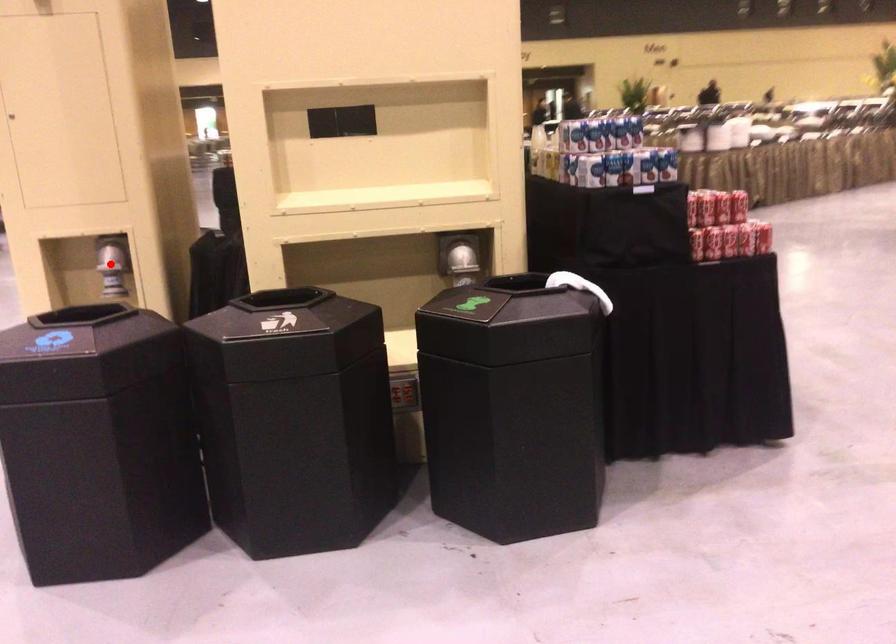
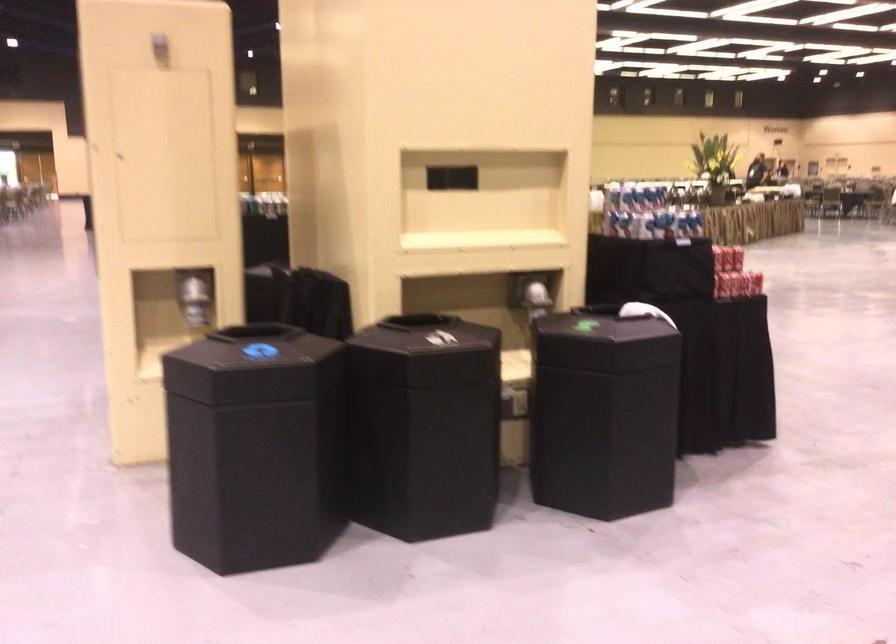
Question: I am providing you with two images of the same scene from different viewpoints. In image1, a red point is highlighted. Considering the same 3D point in image2, which of the following is correct?

Choices:
 (A) It is closer
 (B) It is farther

Answer: (B)